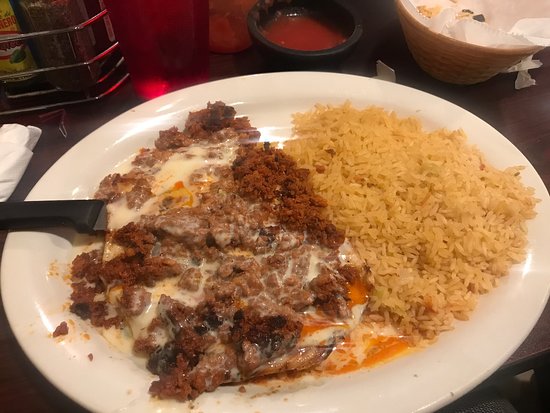
Locate an element on the screen. 1 metal rack is located at coordinates click(x=62, y=41).